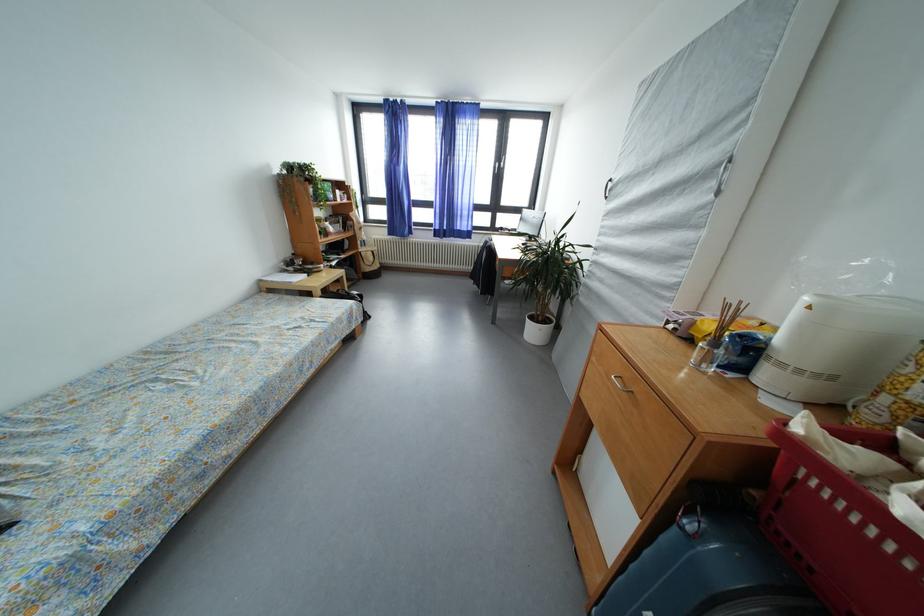
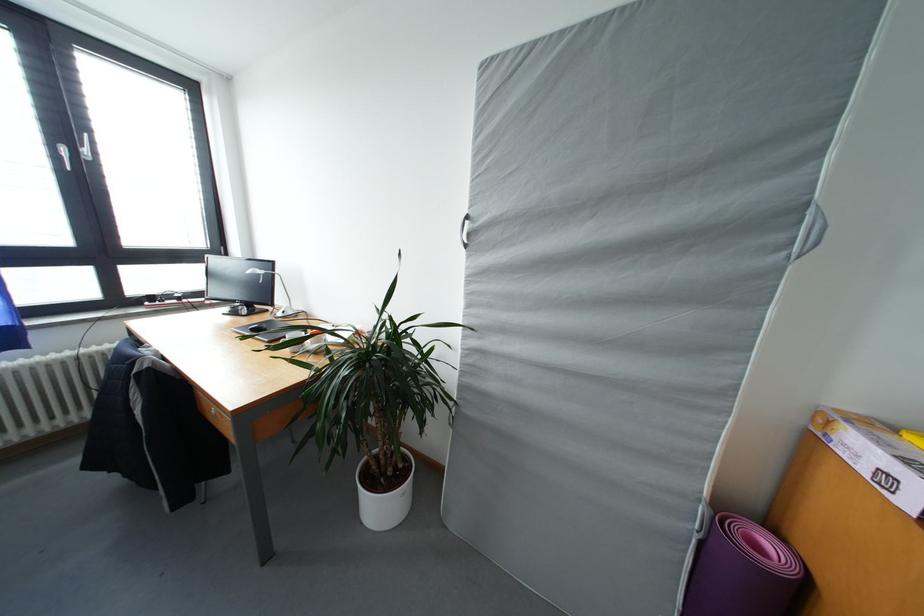
Locate, in the second image, the point that corresponds to [616,185] in the first image.

(473, 222)